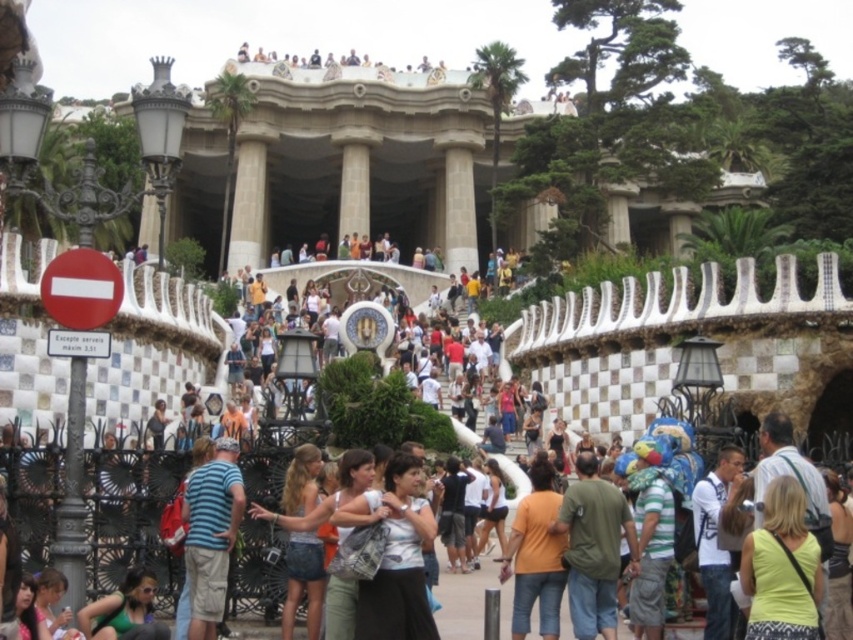
Question: Can you confirm if orange matte shirt at center is positioned below matte black hair at lower left?

Choices:
 (A) yes
 (B) no

Answer: (B)

Question: Where is white cotton shirt at center located in relation to orange matte shirt at center in the image?

Choices:
 (A) left
 (B) right

Answer: (A)

Question: Is orange matte shirt at center above matte black hair at lower left?

Choices:
 (A) yes
 (B) no

Answer: (A)

Question: Considering the real-world distances, which object is closest to the orange matte shirt at center?

Choices:
 (A) matte black hair at lower left
 (B) white cotton shirt at center
 (C) yellow fabric top at center

Answer: (B)

Question: Which object appears closest to the camera in this image?

Choices:
 (A) matte black hair at lower left
 (B) yellow fabric top at center
 (C) white cotton shirt at center
 (D) green fabric dress at lower center

Answer: (A)

Question: Which of the following is the farthest from the observer?

Choices:
 (A) white cotton shirt at center
 (B) yellow fabric top at center

Answer: (A)